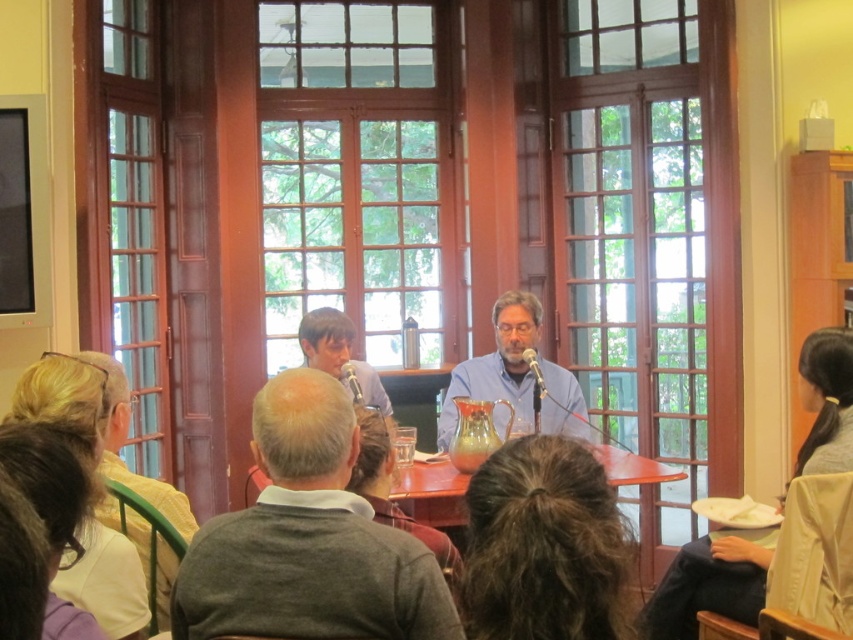
Question: Does gray sweater at center have a larger size compared to blue shirt at center?

Choices:
 (A) no
 (B) yes

Answer: (A)

Question: Based on their relative distances, which object is farther from the smooth gray sweater at center?

Choices:
 (A) blue shirt at center
 (B) gray sweater at center

Answer: (B)

Question: Does blue shirt at center appear under smooth gray sweater at center?

Choices:
 (A) yes
 (B) no

Answer: (B)

Question: Can you confirm if gray sweater at center is thinner than smooth gray sweater at center?

Choices:
 (A) no
 (B) yes

Answer: (A)

Question: Among these points, which one is farthest from the camera?

Choices:
 (A) (343, 333)
 (B) (318, 612)
 (C) (107, 385)
 (D) (555, 412)

Answer: (D)

Question: Among these points, which one is farthest from the camera?

Choices:
 (A) (505, 422)
 (B) (106, 426)
 (C) (334, 312)
 (D) (264, 410)

Answer: (A)